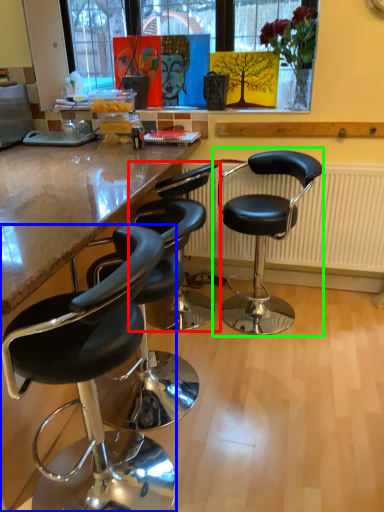
Question: Based on their relative distances, which object is nearer to chair (highlighted by a red box)? Choose from chair (highlighted by a blue box) and chair (highlighted by a green box).

Choices:
 (A) chair
 (B) chair

Answer: (B)